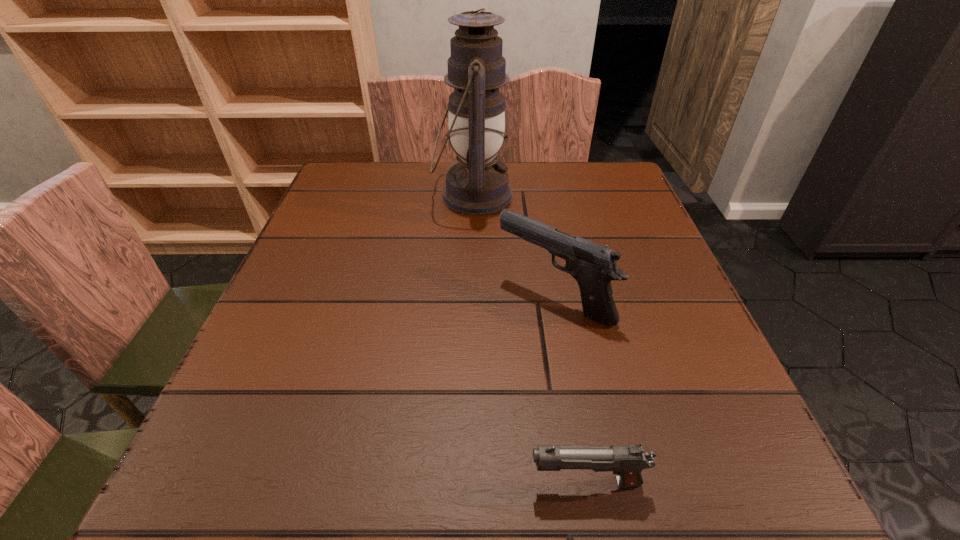
In order to click on free spot at the far right corner of the desktop in this screenshot , I will do `click(625, 199)`.

Where is `free space at the near right corner of the desktop`? This screenshot has width=960, height=540. free space at the near right corner of the desktop is located at coordinates (752, 502).

You are a GUI agent. You are given a task and a screenshot of the screen. Output one action in this format:
    pyautogui.click(x=<x>, y=<y>)
    Task: Click on the free spot between the shorter gun and the second tallest object
    
    Given the screenshot: What is the action you would take?
    pyautogui.click(x=570, y=390)

Image resolution: width=960 pixels, height=540 pixels. In order to click on vacant point located between the shortest object and the farthest object in this screenshot , I will do `click(530, 339)`.

I want to click on unoccupied area between the shortest object and the farthest object, so click(x=530, y=339).

This screenshot has height=540, width=960. Identify the location of free space between the second shortest object and the oil lamp. (514, 246).

The width and height of the screenshot is (960, 540). What are the coordinates of `vacant space that is in between the second nearest object and the nearer gun` in the screenshot? It's located at (570, 390).

Locate an element on the screen. This screenshot has height=540, width=960. vacant space that's between the farthest object and the nearer gun is located at coordinates (530, 339).

This screenshot has width=960, height=540. In order to click on free space between the taller gun and the tallest object in this screenshot , I will do `click(514, 246)`.

Image resolution: width=960 pixels, height=540 pixels. Identify the location of vacant space that is in between the nearest object and the second shortest object. (570, 390).